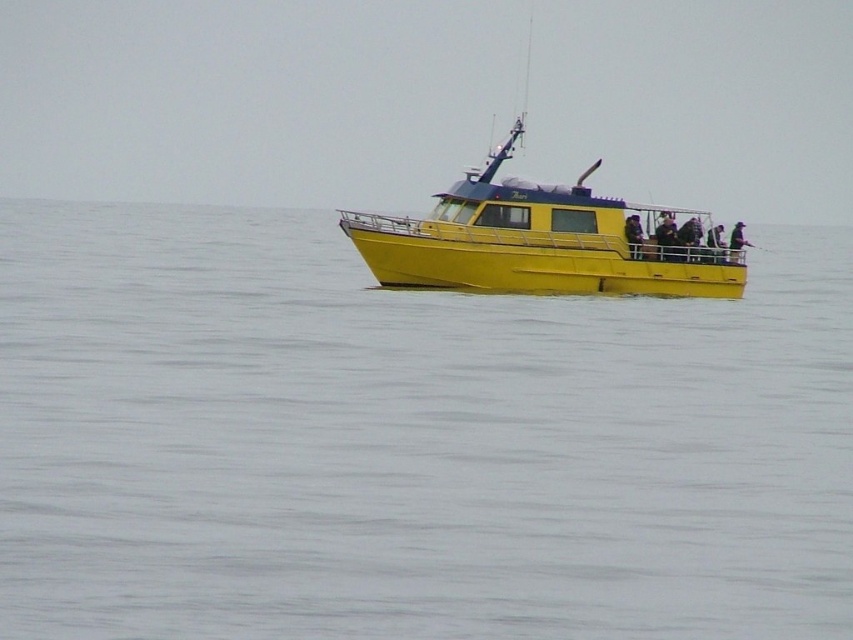
Question: Does yellow matte water at center have a greater width compared to dark blue fabric jacket at center?

Choices:
 (A) no
 (B) yes

Answer: (B)

Question: Estimate the real-world distances between objects in this image. Which object is farther from the yellow matte boat at center?

Choices:
 (A) yellow matte water at center
 (B) dark blue fabric jacket at center
 (C) matte black jacket at upper right

Answer: (A)

Question: Which object appears closest to the camera in this image?

Choices:
 (A) matte black jacket at upper right
 (B) yellow matte water at center
 (C) dark blue fabric jacket at center

Answer: (B)

Question: Can you confirm if yellow matte water at center is positioned to the left of yellow matte boat at center?

Choices:
 (A) yes
 (B) no

Answer: (A)

Question: Which object appears closest to the camera in this image?

Choices:
 (A) matte black jacket at upper right
 (B) dark blue fabric jacket at center

Answer: (B)

Question: From the image, what is the correct spatial relationship of yellow matte boat at center in relation to matte black jacket at upper right?

Choices:
 (A) below
 (B) above

Answer: (B)